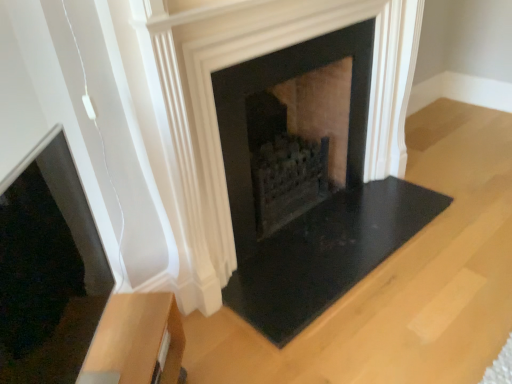
Question: Is light brown wood side table at lower left far away from black stone fireplace at center?

Choices:
 (A) no
 (B) yes

Answer: (A)

Question: Is light brown wood side table at lower left taller than black stone fireplace at center?

Choices:
 (A) no
 (B) yes

Answer: (A)

Question: Would you say light brown wood side table at lower left is outside black stone fireplace at center?

Choices:
 (A) no
 (B) yes

Answer: (B)

Question: Is light brown wood side table at lower left at the right side of black stone fireplace at center?

Choices:
 (A) no
 (B) yes

Answer: (A)

Question: Can black stone fireplace at center be found inside light brown wood side table at lower left?

Choices:
 (A) no
 (B) yes

Answer: (A)

Question: Can you confirm if light brown wood side table at lower left is thinner than black stone fireplace at center?

Choices:
 (A) yes
 (B) no

Answer: (A)

Question: Would you say black stone fireplace at center is outside light brown wood side table at lower left?

Choices:
 (A) yes
 (B) no

Answer: (A)

Question: Is black stone fireplace at center aimed at light brown wood side table at lower left?

Choices:
 (A) yes
 (B) no

Answer: (B)

Question: Does black stone fireplace at center appear on the left side of light brown wood side table at lower left?

Choices:
 (A) yes
 (B) no

Answer: (B)

Question: From a real-world perspective, is black stone fireplace at center on light brown wood side table at lower left?

Choices:
 (A) yes
 (B) no

Answer: (A)

Question: Could light brown wood side table at lower left be considered to be inside black stone fireplace at center?

Choices:
 (A) yes
 (B) no

Answer: (B)

Question: Can you confirm if black stone fireplace at center is shorter than light brown wood side table at lower left?

Choices:
 (A) no
 (B) yes

Answer: (A)

Question: Considering the positions of black stone fireplace at center and light brown wood side table at lower left in the image, is black stone fireplace at center wider or thinner than light brown wood side table at lower left?

Choices:
 (A) thin
 (B) wide

Answer: (B)